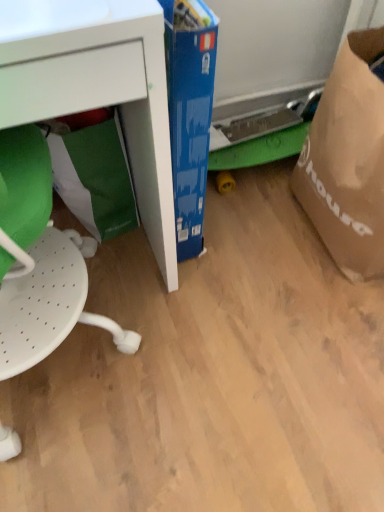
Locate an element on the screen. free spot in front of green paper bag at lower left, the second grocery bag from the right is located at coordinates (116, 267).